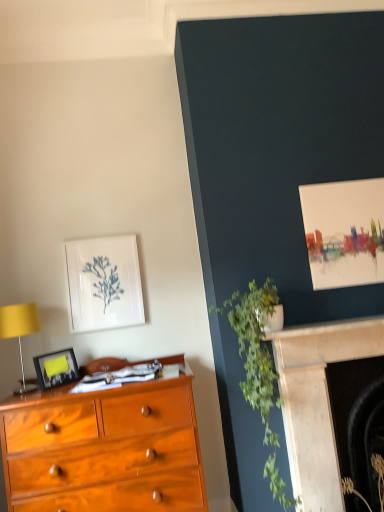
Question: From the image's perspective, is marble fireplace at lower right, the first fireplace in the back-to-front sequence, above green leafy plant at upper right, which is the 1th plant in left-to-right order?

Choices:
 (A) yes
 (B) no

Answer: (B)

Question: Is marble fireplace at lower right, the first fireplace in the back-to-front sequence, smaller than green leafy plant at upper right, which is counted as the 2th plant, starting from the right?

Choices:
 (A) yes
 (B) no

Answer: (A)

Question: Is marble fireplace at lower right, the first fireplace in the back-to-front sequence, looking in the opposite direction of green leafy plant at upper right, which is counted as the 2th plant, starting from the right?

Choices:
 (A) no
 (B) yes

Answer: (A)

Question: Is marble fireplace at lower right, which is the 2th fireplace from front to back, to the right of green leafy plant at upper right, which is counted as the 2th plant, starting from the right, from the viewer's perspective?

Choices:
 (A) yes
 (B) no

Answer: (A)

Question: Considering the relative positions of marble fireplace at lower right, which is the 2th fireplace from front to back, and green leafy plant at upper right, which is the 1th plant in left-to-right order, in the image provided, is marble fireplace at lower right, which is the 2th fireplace from front to back, behind green leafy plant at upper right, which is the 1th plant in left-to-right order,?

Choices:
 (A) no
 (B) yes

Answer: (B)

Question: From the image's perspective, relative to matte yellow lampshade at left, is white matte picture frame at upper left, which is the 2th picture frame in bottom-to-top order, above or below?

Choices:
 (A) below
 (B) above

Answer: (B)

Question: In the image, is white matte picture frame at upper left, the second picture frame when ordered from front to back, positioned in front of or behind matte yellow lampshade at left?

Choices:
 (A) behind
 (B) front

Answer: (A)

Question: Looking at their shapes, would you say white matte picture frame at upper left, the first picture frame positioned from the back, is wider or thinner than matte yellow lampshade at left?

Choices:
 (A) wide
 (B) thin

Answer: (B)

Question: In terms of size, does white matte picture frame at upper left, positioned as the first picture frame in top-to-bottom order, appear bigger or smaller than matte yellow lampshade at left?

Choices:
 (A) big
 (B) small

Answer: (B)

Question: Looking at their shapes, would you say matte yellow lampshade at left is wider or thinner than green leafy plant at upper right, which is the 1th plant in left-to-right order?

Choices:
 (A) thin
 (B) wide

Answer: (A)

Question: From a real-world perspective, is matte yellow lampshade at left physically located above or below green leafy plant at upper right, which is the 1th plant in left-to-right order?

Choices:
 (A) below
 (B) above

Answer: (B)

Question: Is matte yellow lampshade at left taller or shorter than green leafy plant at upper right, which is the 1th plant in left-to-right order?

Choices:
 (A) short
 (B) tall

Answer: (A)

Question: From the image's perspective, relative to green leafy plant at upper right, which is counted as the 2th plant, starting from the right, is matte yellow lampshade at left above or below?

Choices:
 (A) below
 (B) above

Answer: (B)

Question: In terms of height, does matte black picture frame at left, the first picture frame positioned from the front, look taller or shorter compared to green leafy plant at upper right, which is counted as the 2th plant, starting from the right?

Choices:
 (A) tall
 (B) short

Answer: (B)

Question: Do you think matte black picture frame at left, the second picture frame viewed from the back, is within green leafy plant at upper right, which is counted as the 2th plant, starting from the right, or outside of it?

Choices:
 (A) inside
 (B) outside

Answer: (B)